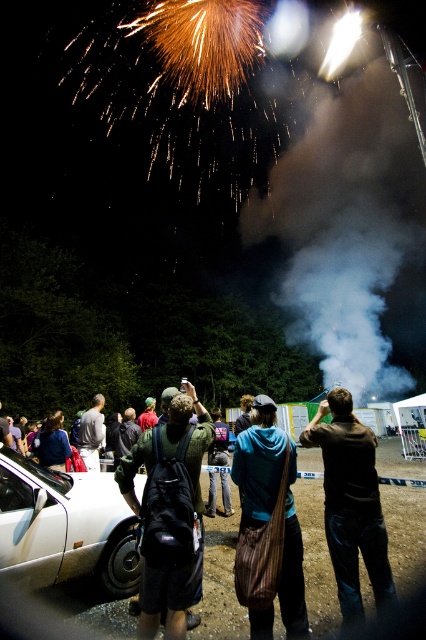
Question: Estimate the real-world distances between objects in this image. Which object is closer to the dark brown leather jacket at center?

Choices:
 (A) white matte car at lower left
 (B) black backpack at center
 (C) denim jacket at center
 (D) blue cotton hoodie at center

Answer: (D)

Question: Does dark brown leather jacket at center appear on the right side of black backpack at center?

Choices:
 (A) yes
 (B) no

Answer: (A)

Question: Among these objects, which one is nearest to the camera?

Choices:
 (A) dark gray backpack at center
 (B) blue cotton hoodie at center
 (C) white matte car at lower left
 (D) denim jacket at center

Answer: (B)

Question: Does dark brown leather jacket at center appear over black backpack at center?

Choices:
 (A) no
 (B) yes

Answer: (A)

Question: Which is nearer to the black backpack at center?

Choices:
 (A) white matte car at lower left
 (B) dark brown leather jacket at center

Answer: (A)

Question: Is white matte car at lower left below black backpack at center?

Choices:
 (A) no
 (B) yes

Answer: (B)